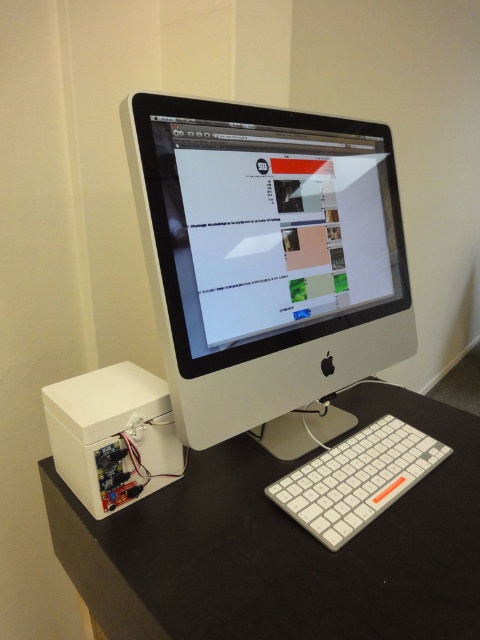
You are sitting in front of the workspace and want to reach for the white plastic keyboard at lower right. Is the white plastic computer monitor at center blocking your direct access to it?

The white plastic computer monitor at center is closer to the viewer than the white plastic keyboard at lower right, so it may block direct access to the keyboard.

You are setting up a new workspace and want to place a small electronic device on the desk. The device requires a specific placement at coordinates point (283, 547). Based on the scene description, where exactly on the desk should you place the device?

The point (283, 547) corresponds to the white matte black plastic computer desk at lower left, so you should place the device there.

You are setting up a desk and need to place both the white plastic computer monitor at center and the white plastic keyboard at lower right. Which object should you place first if you want the wider item to be positioned in the middle of the desk?

The white plastic computer monitor at center is wider than the white plastic keyboard at lower right, so you should place the white plastic computer monitor at center first to ensure it is centered on the desk.